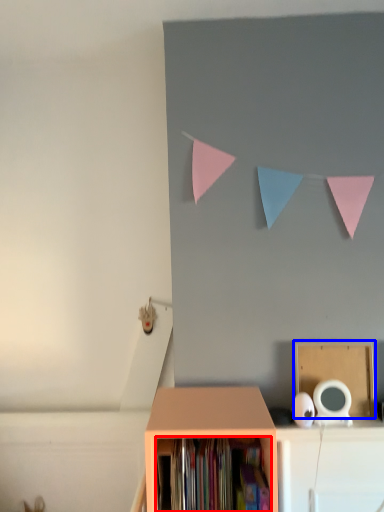
Question: Which object is closer to the camera taking this photo, book (highlighted by a red box) or cardboard box (highlighted by a blue box)?

Choices:
 (A) book
 (B) cardboard box

Answer: (A)